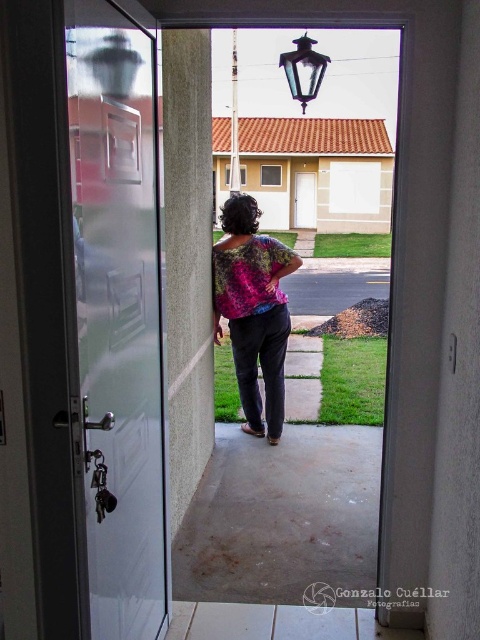
Question: Considering the real-world distances, which object is closest to the floral fabric blouse at center?

Choices:
 (A) white glossy door at center
 (B) frosted glass door at left

Answer: (B)

Question: Among these objects, which one is nearest to the camera?

Choices:
 (A) floral fabric blouse at center
 (B) white glossy door at center
 (C) frosted glass door at left

Answer: (C)

Question: Which of the following is the farthest from the observer?

Choices:
 (A) white glossy door at center
 (B) floral fabric blouse at center
 (C) frosted glass door at left

Answer: (A)

Question: Is frosted glass door at left positioned before floral fabric blouse at center?

Choices:
 (A) yes
 (B) no

Answer: (A)

Question: Does frosted glass door at left have a smaller size compared to white glossy door at center?

Choices:
 (A) no
 (B) yes

Answer: (B)

Question: From the image, what is the correct spatial relationship of frosted glass door at left in relation to white glossy door at center?

Choices:
 (A) below
 (B) above

Answer: (A)